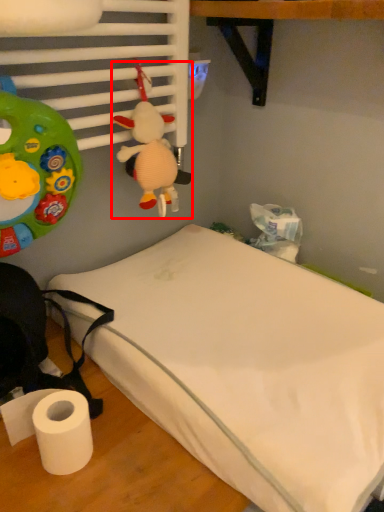
Question: Considering the relative positions of toy (annotated by the red box) and bed in the image provided, where is toy (annotated by the red box) located with respect to the staircase?

Choices:
 (A) left
 (B) right

Answer: (A)